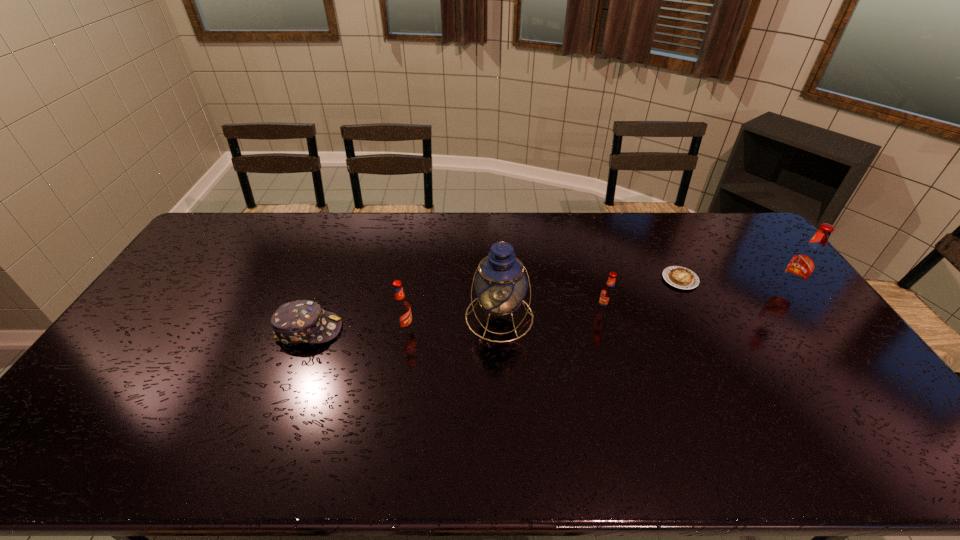
At what (x,y) coordinates should I click in order to perform the action: click on the fourth shortest object. Please return your answer as a coordinate pair (x, y). The width and height of the screenshot is (960, 540). Looking at the image, I should click on click(x=401, y=308).

Identify the location of the second shortest root beer. The height and width of the screenshot is (540, 960). (401, 308).

Locate an element on the screen. The image size is (960, 540). the second root beer from right to left is located at coordinates (607, 296).

Locate an element on the screen. This screenshot has width=960, height=540. the fourth object from left to right is located at coordinates (607, 296).

The image size is (960, 540). Find the location of `the tallest root beer`. the tallest root beer is located at coordinates (802, 267).

Locate an element on the screen. The height and width of the screenshot is (540, 960). the rightmost root beer is located at coordinates (802, 267).

I want to click on the shortest object, so click(x=677, y=276).

You are a GUI agent. You are given a task and a screenshot of the screen. Output one action in this format:
    pyautogui.click(x=<x>, y=<y>)
    Task: Click on the second object from right to left
    Image resolution: width=960 pixels, height=540 pixels.
    Given the screenshot: What is the action you would take?
    pyautogui.click(x=677, y=276)

This screenshot has height=540, width=960. In order to click on the third object from left to right in this screenshot , I will do pyautogui.click(x=500, y=284).

Where is `headwear`? Image resolution: width=960 pixels, height=540 pixels. headwear is located at coordinates (302, 321).